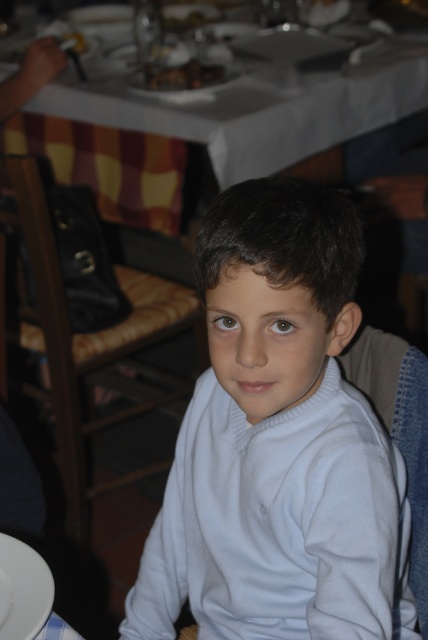
You are trying to decide whether the white woolen sweater at center can be placed on the white glossy plate at lower left. Based on their sizes, is this possible?

The white woolen sweater at center is larger in size than the white glossy plate at lower left, so it cannot be placed on top of the plate since the sweater is bigger.

Based on the scene description, where is the white woolen sweater at center located in terms of its 2D coordinates?

The white woolen sweater at center is located at the 2D coordinates of point (279, 444).